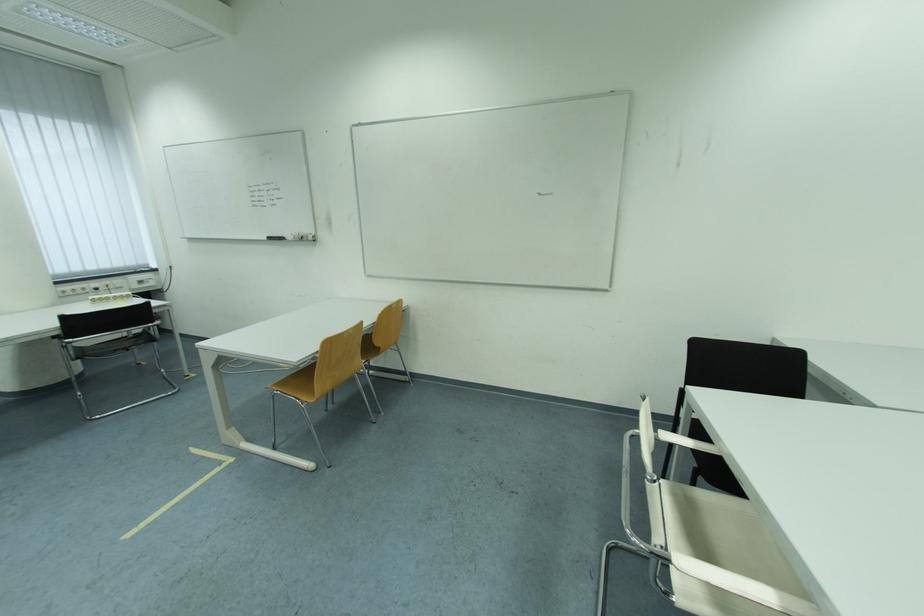
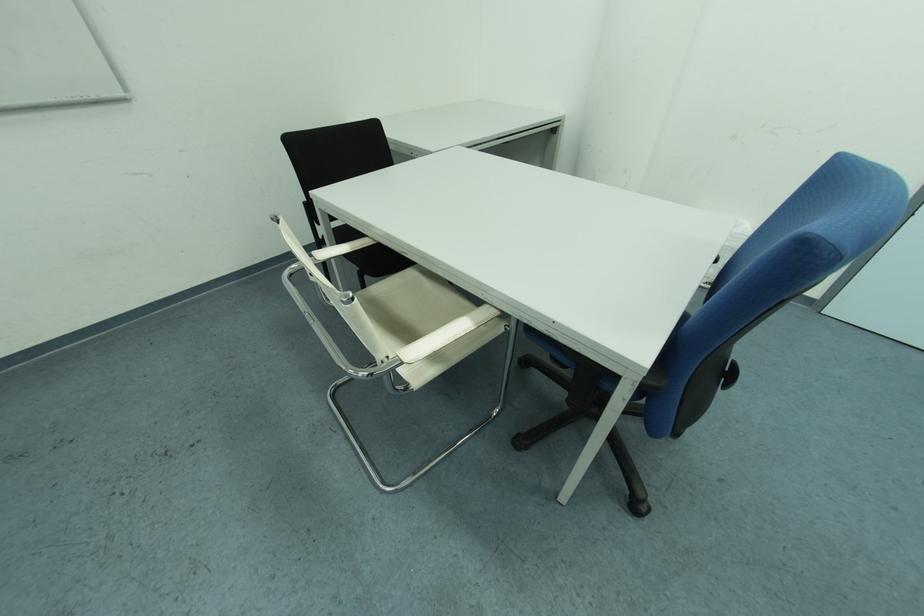
The images are taken continuously from a first-person perspective. In which direction is your viewpoint rotating?

The rotation direction of the camera is right-down.